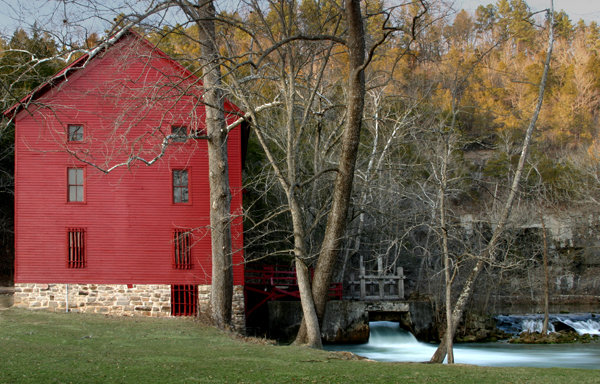
The image size is (600, 384). What are the coordinates of `4 paned red windows` in the screenshot? It's located at (77, 185), (181, 187).